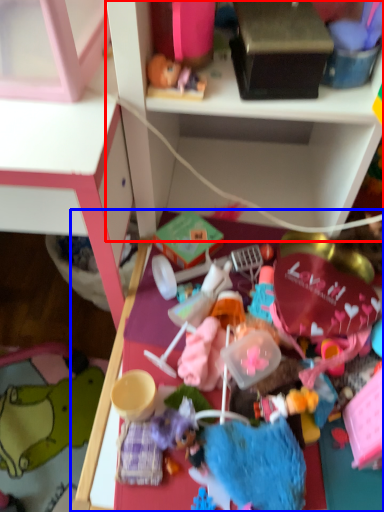
Question: Which object is closer to the camera taking this photo, shelf (highlighted by a red box) or table (highlighted by a blue box)?

Choices:
 (A) shelf
 (B) table

Answer: (A)